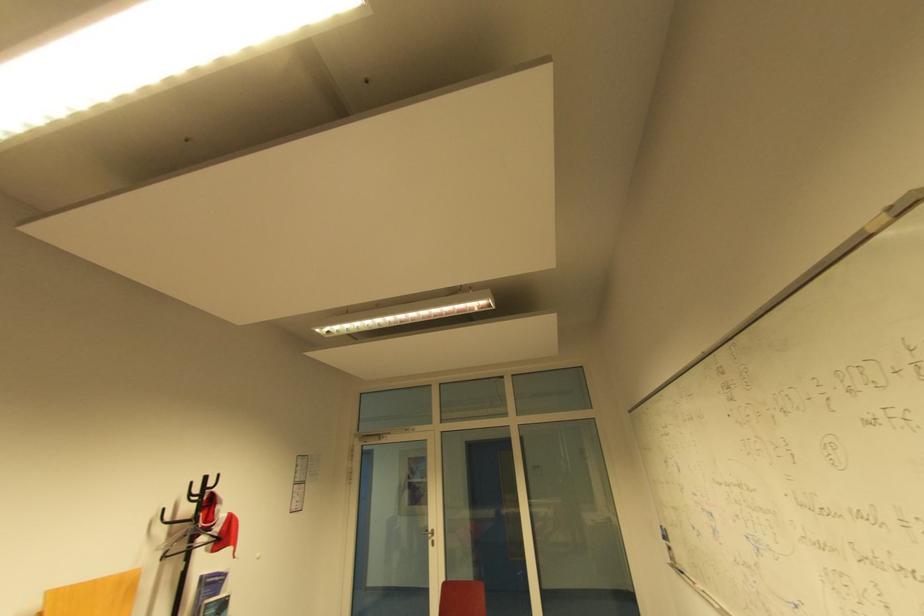
Describe the element at coordinates (225, 482) in the screenshot. The width and height of the screenshot is (924, 616). I see `the black coat hook` at that location.